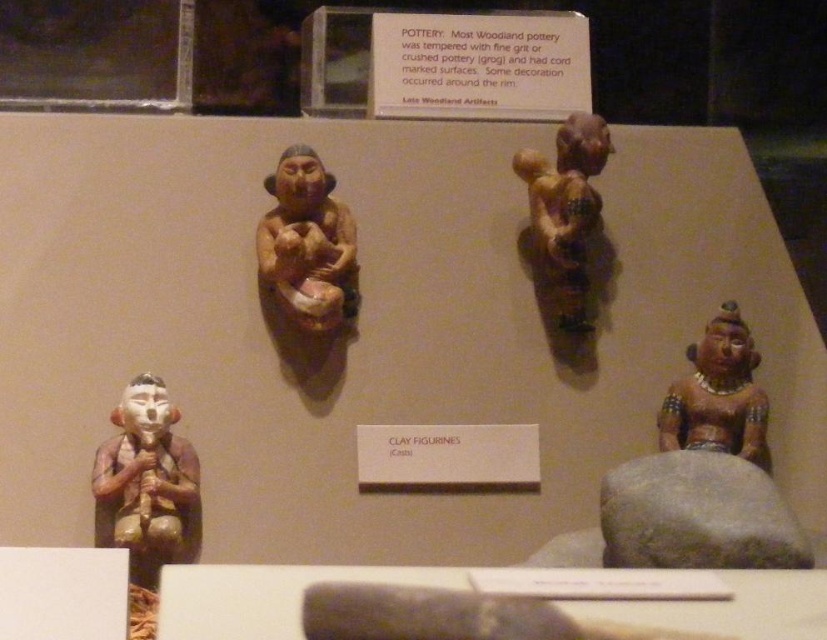
You are a visitor at the museum and want to take a photo of the two points mentioned in the scene. Which point is closer to you, point (347, 250) or point (586, 220)?

Point (347, 250) is closer to you than point (586, 220).

You are a museum curator planning to place a protective glass cover over the exhibit table. The cover must accommodate both the matte clay figurine at center and the matte clay figurine at lower right. Considering their sizes, which figurine requires more vertical space in the cover?

The matte clay figurine at center requires more vertical space because it is larger in size than the matte clay figurine at lower right.

You are a museum curator examining the exhibit table. You need to determine which of the two figurines, the matte brown figurine at lower left or the matte clay figurine at center, has a smaller width. Which one is it?

The matte brown figurine at lower left is thinner than the matte clay figurine at center, so the matte brown figurine at lower left has a smaller width.